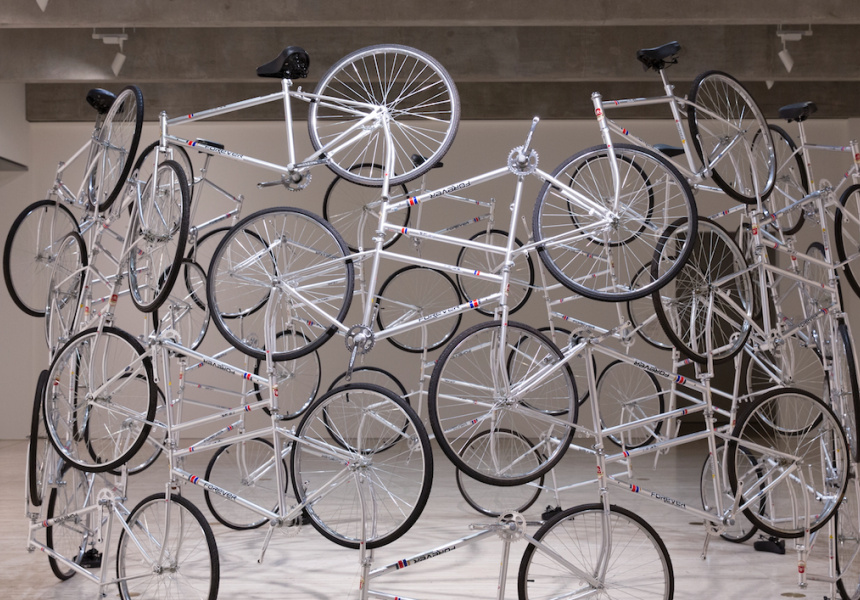
Where is `floor`? The height and width of the screenshot is (600, 860). floor is located at coordinates pyautogui.click(x=13, y=499).